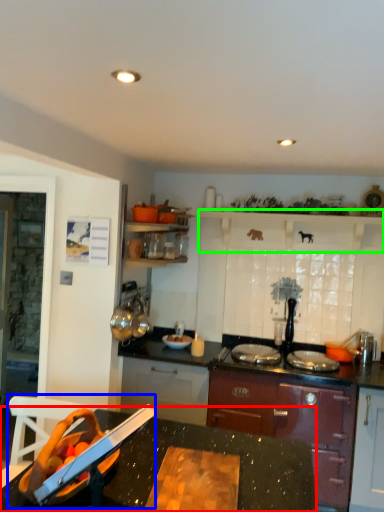
Question: Based on their relative distances, which object is nearer to countertop (highlighted by a red box)? Choose from sink (highlighted by a blue box) and shelf (highlighted by a green box).

Choices:
 (A) sink
 (B) shelf

Answer: (A)